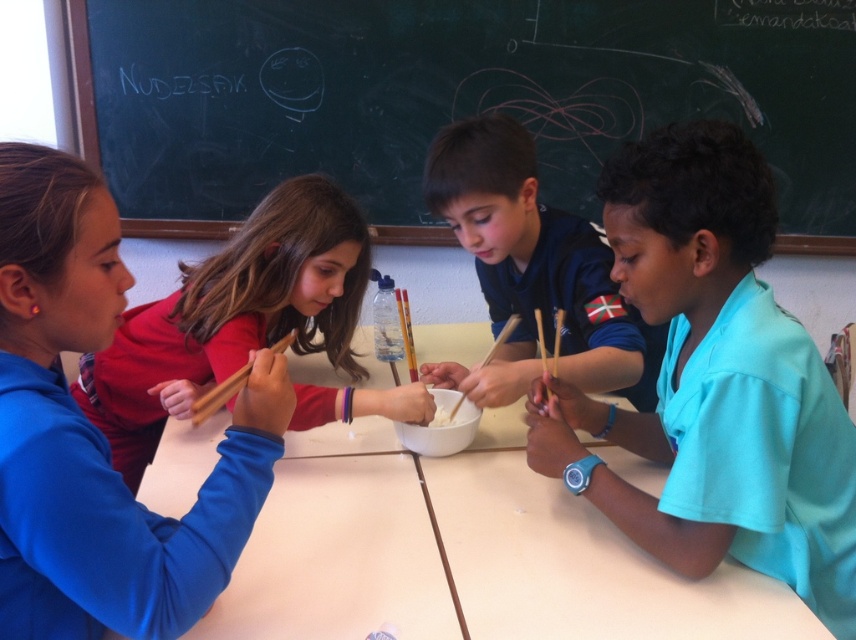
Can you confirm if matte red shirt at upper left is taller than wooden chopstick at center?

Yes.

Consider the image. Who is positioned more to the right, matte red shirt at upper left or wooden chopstick at center?

wooden chopstick at center

Is point (342, 227) closer to viewer compared to point (556, 321)?

Yes, it is in front of point (556, 321).

Locate an element on the screen. The image size is (856, 640). matte red shirt at upper left is located at coordinates (232, 316).

Does teal smooth shirt at right have a lesser height compared to wooden chopstick at center?

In fact, teal smooth shirt at right may be taller than wooden chopstick at center.

Image resolution: width=856 pixels, height=640 pixels. Identify the location of teal smooth shirt at right. (712, 381).

You are a GUI agent. You are given a task and a screenshot of the screen. Output one action in this format:
    pyautogui.click(x=<x>, y=<y>)
    Task: Click on the teal smooth shirt at right
    
    Given the screenshot: What is the action you would take?
    coord(712,381)

Who is lower down, matte red shirt at upper left or blue fabric shirt at center?

matte red shirt at upper left

Can you confirm if matte red shirt at upper left is taller than blue fabric shirt at center?

Yes.

Is point (173, 413) less distant than point (569, 310)?

Yes, it is.

Where is `matte red shirt at upper left`? Image resolution: width=856 pixels, height=640 pixels. matte red shirt at upper left is located at coordinates (232, 316).